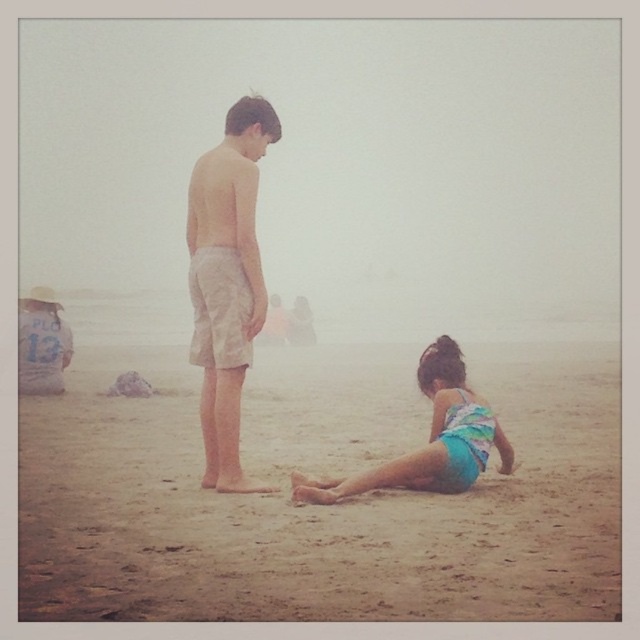
Question: Estimate the real-world distances between objects in this image. Which object is farther from the beige cotton shorts at center?

Choices:
 (A) teal swimsuit at lower right
 (B) fine-grained sand at lower center

Answer: (B)

Question: Can you confirm if fine-grained sand at lower center is positioned to the right of beige cotton shorts at center?

Choices:
 (A) yes
 (B) no

Answer: (A)

Question: Can you confirm if beige cotton shorts at center is positioned to the right of teal swimsuit at lower right?

Choices:
 (A) no
 (B) yes

Answer: (A)

Question: Among these objects, which one is nearest to the camera?

Choices:
 (A) teal swimsuit at lower right
 (B) fine-grained sand at lower center

Answer: (B)

Question: Which object is positioned farthest from the teal swimsuit at lower right?

Choices:
 (A) beige cotton shorts at center
 (B) fine-grained sand at lower center

Answer: (B)

Question: Does fine-grained sand at lower center appear on the left side of teal swimsuit at lower right?

Choices:
 (A) no
 (B) yes

Answer: (A)